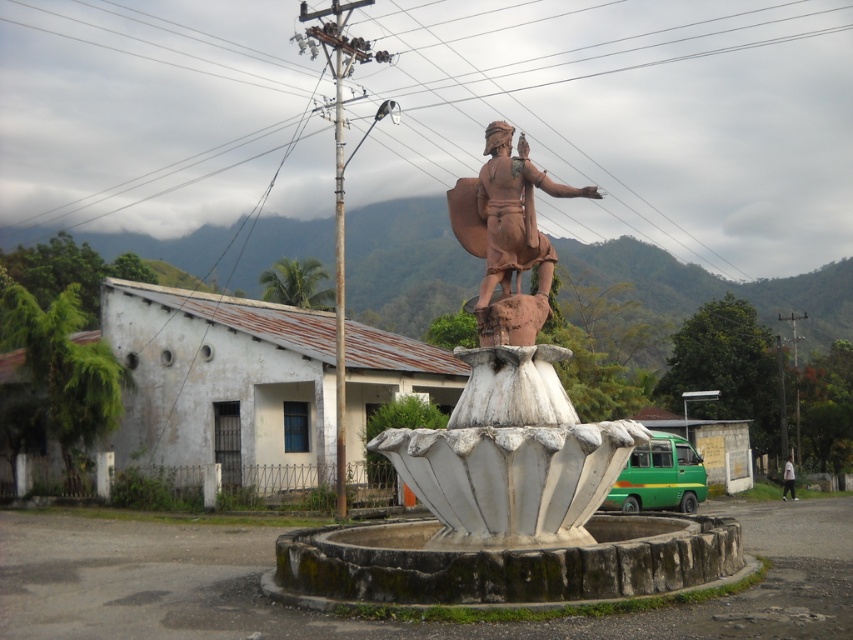
Can you confirm if rustic stone fountain at center is thinner than brown clay statue at center?

Indeed, rustic stone fountain at center has a lesser width compared to brown clay statue at center.

Looking at this image, who is taller, rustic stone fountain at center or brown clay statue at center?

With more height is brown clay statue at center.

Is point (650, 536) closer to camera compared to point (500, 324)?

That is False.

Locate an element on the screen. rustic stone fountain at center is located at coordinates (508, 497).

Can you confirm if rustic stone fountain at center is positioned above white fabric person at lower right?

Indeed, rustic stone fountain at center is positioned over white fabric person at lower right.

Who is more forward, (x=630, y=509) or (x=784, y=465)?

Point (x=630, y=509)

This screenshot has width=853, height=640. Find the location of `rustic stone fountain at center`. rustic stone fountain at center is located at coordinates (508, 497).

Is brown clay statue at center smaller than white fabric person at lower right?

Yes.

Between point (485, 182) and point (782, 493), which one is positioned in front?

Point (485, 182)

Find the location of a particular element. The width and height of the screenshot is (853, 640). brown clay statue at center is located at coordinates (508, 236).